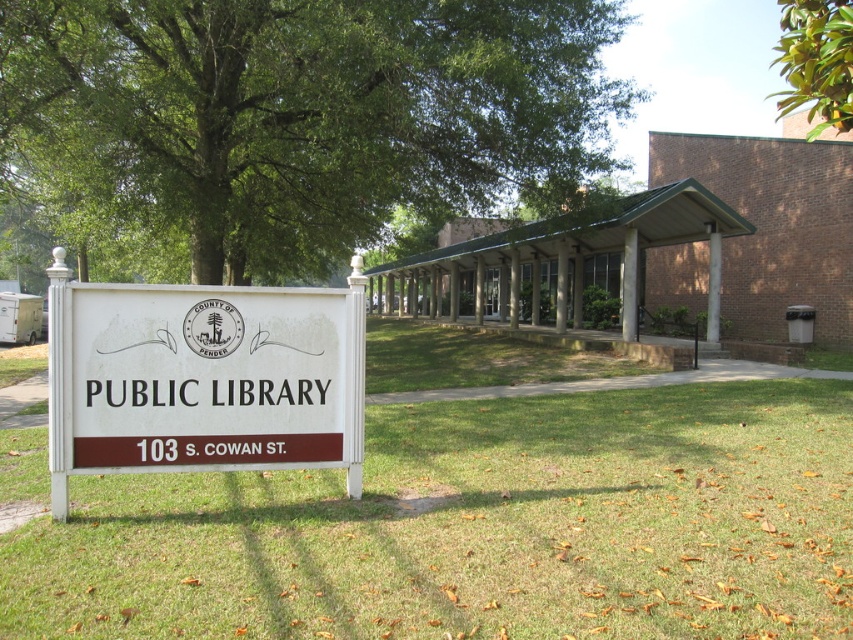
Can you confirm if green grass at lower center is positioned above green leafy tree at upper right?

Actually, green grass at lower center is below green leafy tree at upper right.

Is point (451, 422) closer to camera compared to point (792, 36)?

That is False.

The width and height of the screenshot is (853, 640). I want to click on green grass at lower center, so click(x=479, y=529).

This screenshot has width=853, height=640. What do you see at coordinates (292, 120) in the screenshot? I see `green leafy tree at upper left` at bounding box center [292, 120].

Who is shorter, green leafy tree at upper left or white plastic sign at center?

With less height is white plastic sign at center.

Image resolution: width=853 pixels, height=640 pixels. In order to click on green leafy tree at upper left in this screenshot , I will do `click(292, 120)`.

This screenshot has width=853, height=640. Describe the element at coordinates (479, 529) in the screenshot. I see `green grass at lower center` at that location.

Is point (630, 426) positioned in front of point (115, 332)?

No, (630, 426) is further to viewer.

What do you see at coordinates (479, 529) in the screenshot?
I see `green grass at lower center` at bounding box center [479, 529].

The height and width of the screenshot is (640, 853). Find the location of `green grass at lower center`. green grass at lower center is located at coordinates (479, 529).